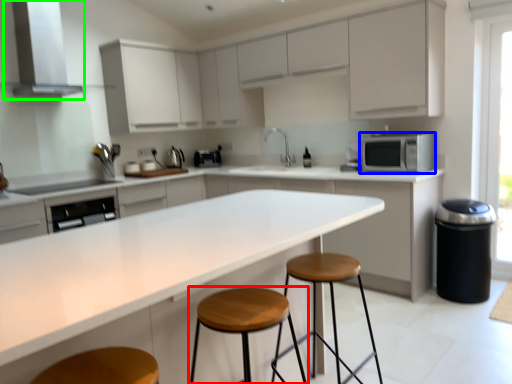
Question: Which object is the farthest from stool (highlighted by a red box)? Choose among these: microwave oven (highlighted by a blue box) or exhaust hood (highlighted by a green box).

Choices:
 (A) microwave oven
 (B) exhaust hood

Answer: (B)